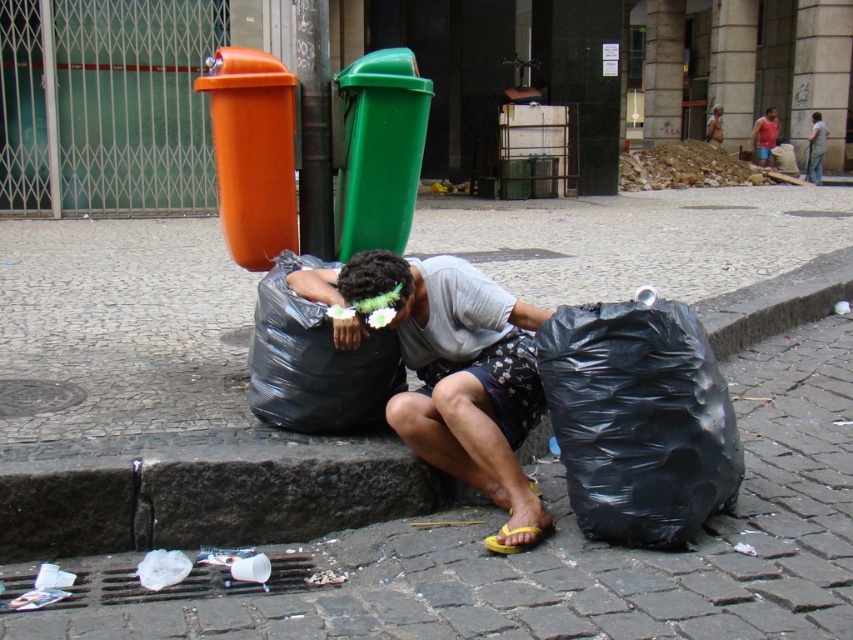
You are a delivery person who needs to place a package on the ground near the black plastic bag at lower right and the dark gray fabric shirt at center. Which object should you place the package closer to if you want it to be higher off the ground?

The dark gray fabric shirt at center is taller than the black plastic bag at lower right, so placing the package near the dark gray fabric shirt at center would position it higher off the ground.

You are a delivery person who needs to place a 1.5 meter long package between the black plastic bag at lower right and the dark gray fabric shirt at center. Is there enough space for the package to fit without overlapping either object?

The distance between the black plastic bag at lower right and the dark gray fabric shirt at center is 17.06 meters. Since the package is only 1.5 meters long, there is ample space to place it between them without overlapping either object.